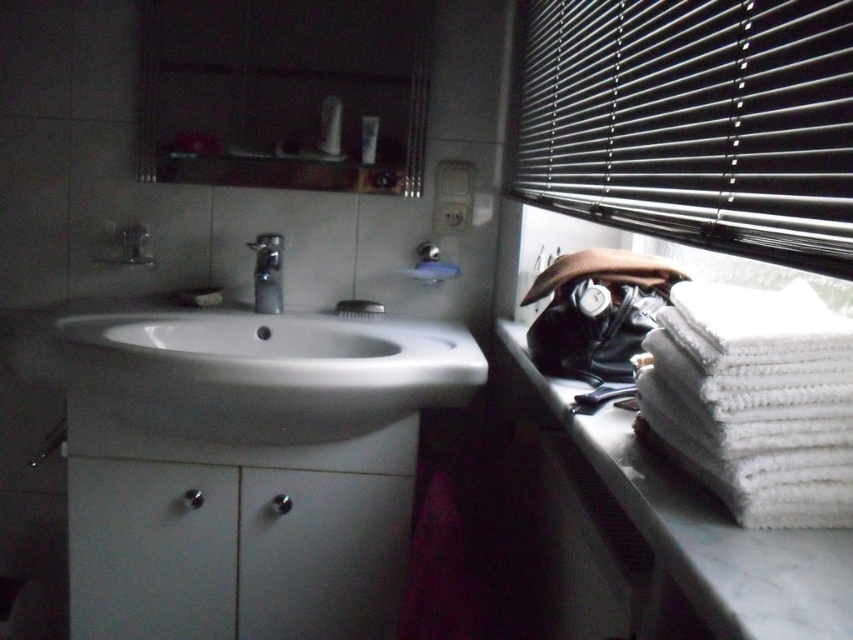
Between point (827, 538) and point (325, 100), which one is positioned in front?

Point (827, 538)

Does point (769, 557) come closer to viewer compared to point (334, 138)?

Yes, point (769, 557) is in front of point (334, 138).

Between point (831, 588) and point (335, 147), which one is positioned in front?

Point (831, 588) is in front.

Find the location of a particular element. The width and height of the screenshot is (853, 640). white marble towel at right is located at coordinates (698, 524).

Does white glossy sink at center have a greater height compared to white marble towel at right?

Yes, white glossy sink at center is taller than white marble towel at right.

Does point (80, 372) come farther from viewer compared to point (747, 561)?

That is True.

Where is `white glossy sink at center`? Image resolution: width=853 pixels, height=640 pixels. white glossy sink at center is located at coordinates (258, 369).

Is black metal blinds at upper right to the right of satin nickel faucet at center from the viewer's perspective?

Yes, black metal blinds at upper right is to the right of satin nickel faucet at center.

Find the location of a particular element. The height and width of the screenshot is (640, 853). black metal blinds at upper right is located at coordinates (691, 122).

Who is more forward, (691,220) or (280,280)?

Point (691,220)

You are a GUI agent. You are given a task and a screenshot of the screen. Output one action in this format:
    pyautogui.click(x=<x>, y=<y>)
    Task: Click on the black metal blinds at upper right
    Image resolution: width=853 pixels, height=640 pixels.
    Given the screenshot: What is the action you would take?
    pyautogui.click(x=691, y=122)